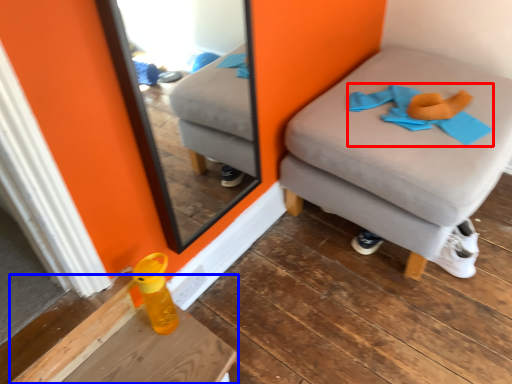
Question: Which object appears closest to the camera in this image, clothe (highlighted by a red box) or table (highlighted by a blue box)?

Choices:
 (A) clothe
 (B) table

Answer: (B)